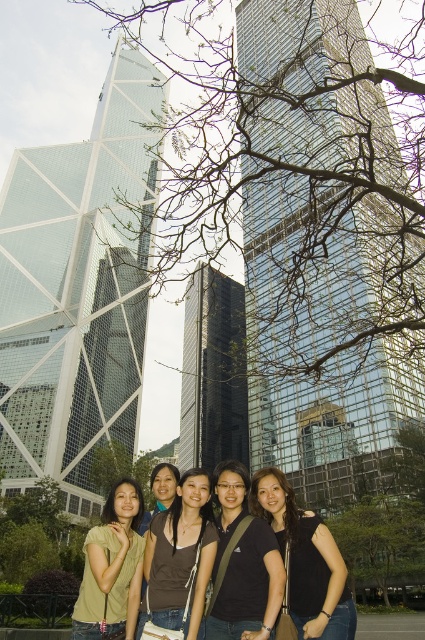
Does point (272, 556) lie behind point (95, 621)?

That is True.

Can you confirm if black matte shirt at center is shorter than light green t-shirt at center?

Indeed, black matte shirt at center has a lesser height compared to light green t-shirt at center.

Locate an element on the screen. This screenshot has width=425, height=640. black matte shirt at center is located at coordinates (243, 564).

In the scene shown: Can you confirm if brown fabric shirt at center is bigger than light green t-shirt at center?

No.

Is brown fabric shirt at center thinner than light green t-shirt at center?

Yes.

Where is `brown fabric shirt at center`? This screenshot has height=640, width=425. brown fabric shirt at center is located at coordinates (180, 557).

Does black matte tank top at lower center have a lesser width compared to brown fabric shirt at center?

In fact, black matte tank top at lower center might be wider than brown fabric shirt at center.

Which is more to the left, black matte tank top at lower center or brown fabric shirt at center?

From the viewer's perspective, brown fabric shirt at center appears more on the left side.

Does point (257, 499) come behind point (178, 627)?

Yes.

Locate an element on the screen. The height and width of the screenshot is (640, 425). black matte tank top at lower center is located at coordinates (306, 561).